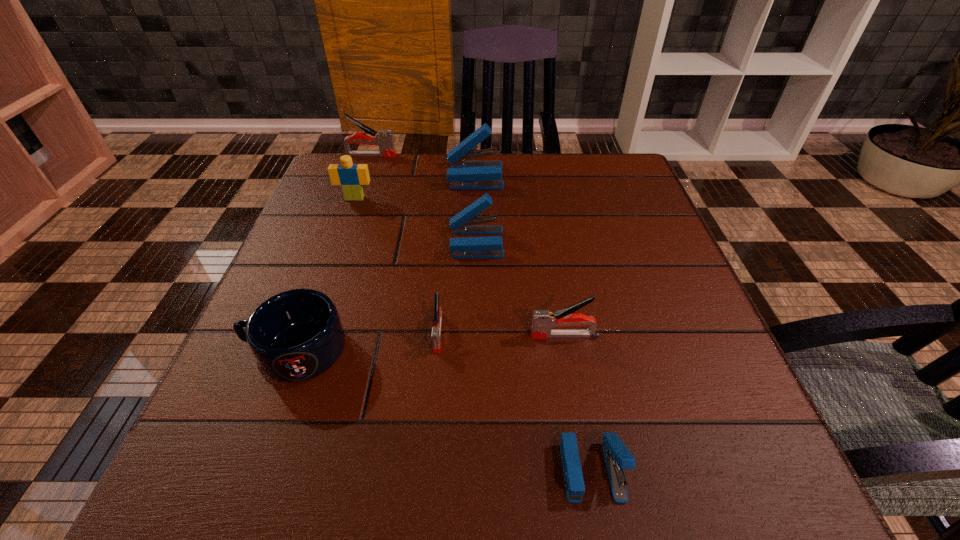
Identify the location of the second gray stapler from right to left. The width and height of the screenshot is (960, 540). (438, 314).

Locate an element on the screen. the nearest stapler is located at coordinates (617, 456).

The height and width of the screenshot is (540, 960). In order to click on the nearest blue stapler in this screenshot , I will do `click(617, 456)`.

Locate an element on the screen. The image size is (960, 540). vacant space located 0.180m on the handle side of the farthest object is located at coordinates (459, 156).

Find the location of a particular element. The width and height of the screenshot is (960, 540). vacant space situated 0.310m on the front of the farthest blue stapler is located at coordinates (x=473, y=274).

I want to click on vacant space located 0.270m on the face of the beige Lego, so click(326, 277).

The image size is (960, 540). I want to click on vacant area located on the handle side of the second smallest gray stapler, so click(336, 335).

Image resolution: width=960 pixels, height=540 pixels. I want to click on free spot located 0.380m on the handle side of the second smallest gray stapler, so click(x=320, y=335).

The image size is (960, 540). In order to click on vacant space located 0.170m on the handle side of the second smallest gray stapler in this screenshot , I will do `click(436, 335)`.

The height and width of the screenshot is (540, 960). I want to click on free location located on the front of the second biggest blue stapler, so click(x=476, y=296).